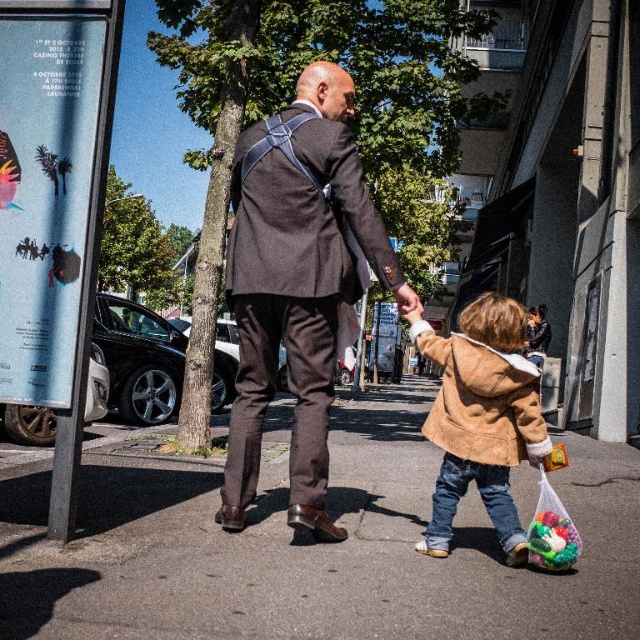
You are a tailor observing the matte brown suit at center and the tan suede jacket at lower right. Which clothing item has a narrower width?

The matte brown suit at center has a lesser width compared to the tan suede jacket at lower right.

You are a photographer standing in front of the two people in the image. You want to take a photo that includes both the matte brown suit at center and the tan suede jacket at lower right. Which object should you focus on first to ensure both are in the frame?

You should focus on the matte brown suit at center first because it is closer to you than the tan suede jacket at lower right, ensuring both are in the frame.

Consider the image. You are standing at the camera position and want to throw a ball to the point marked at coordinates (337, 452). Is the distance within your throwing range of 8 meters?

The point marked at coordinates (337, 452) is 7.48 meters away from the camera, so yes, the distance is within the throwing range of 8 meters.